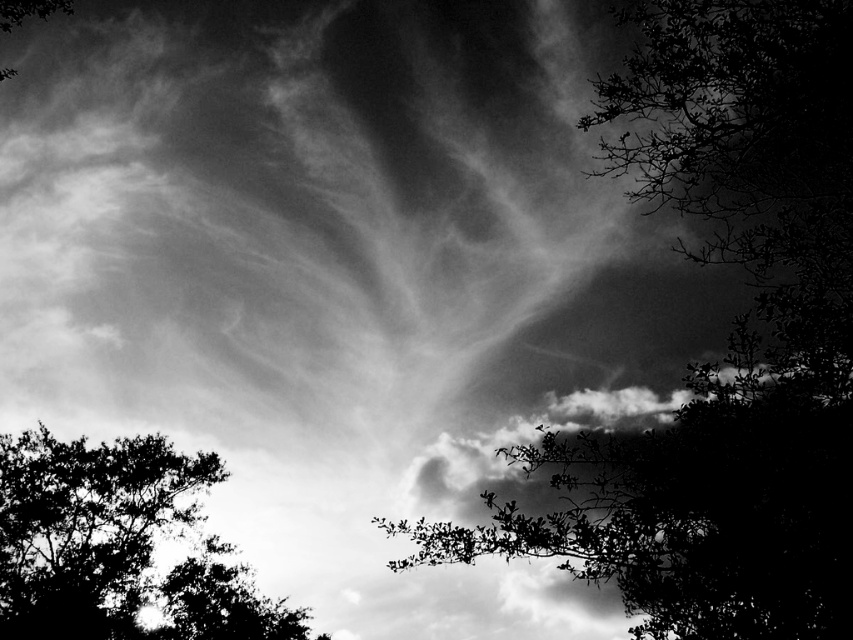
You are an artist trying to paint this scene. You want to ensure the silhouette leafy branch at upper right and the dark leafy tree at lower left are positioned correctly. According to the image, which object is closer to the viewer?

The silhouette leafy branch at upper right is closer to the viewer than the dark leafy tree at lower left because it is in front of it.

In the scene shown: You are an artist trying to paint this scene. You want to ensure the silhouette leafy branch at upper right and the dark leafy tree at lower left are proportionally accurate. Which object should you paint taller?

The silhouette leafy branch at upper right should be painted taller because it has a greater height compared to the dark leafy tree at lower left according to the description.